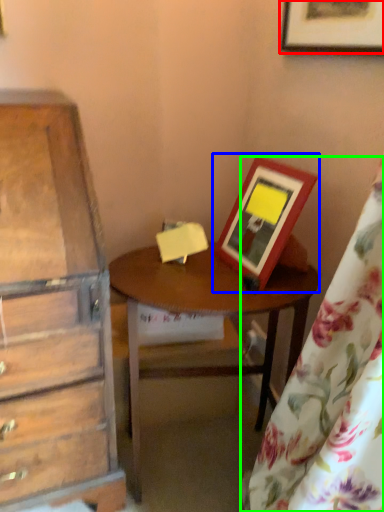
Question: Which object is positioned farthest from picture frame (highlighted by a red box)? Select from picture frame (highlighted by a blue box) and curtain (highlighted by a green box).

Choices:
 (A) picture frame
 (B) curtain

Answer: (B)